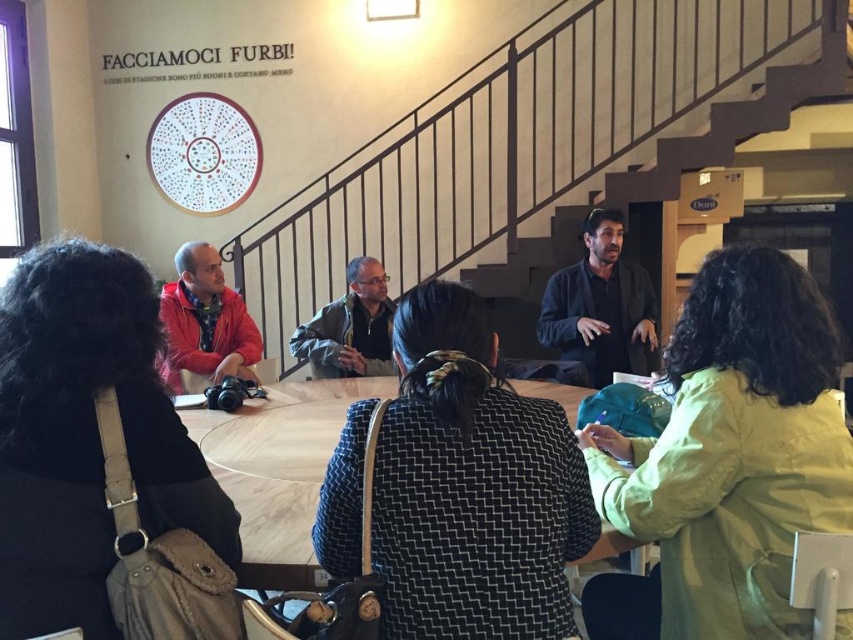
Between point (268, 436) and point (340, 368), which one is positioned in front?

Point (268, 436)

Between wooden round table at center and green fabric jacket at center, which one appears on the left side from the viewer's perspective?

wooden round table at center

Between point (366, 384) and point (337, 339), which one is positioned behind?

The point (337, 339) is behind.

I want to click on wooden round table at center, so click(277, 468).

Is green matte jacket at upper right shorter than wooden round table at center?

In fact, green matte jacket at upper right may be taller than wooden round table at center.

Is green matte jacket at upper right above wooden round table at center?

Indeed, green matte jacket at upper right is positioned over wooden round table at center.

Where is `green matte jacket at upper right`? green matte jacket at upper right is located at coordinates (727, 460).

Can you confirm if black textured jacket at center is positioned below green fabric jacket at center?

Correct, black textured jacket at center is located below green fabric jacket at center.

Which of these two, black textured jacket at center or green fabric jacket at center, stands taller?

black textured jacket at center is taller.

Is point (425, 428) positioned in front of point (374, 282)?

That is True.

Where is `black textured jacket at center`? The image size is (853, 640). black textured jacket at center is located at coordinates (471, 484).